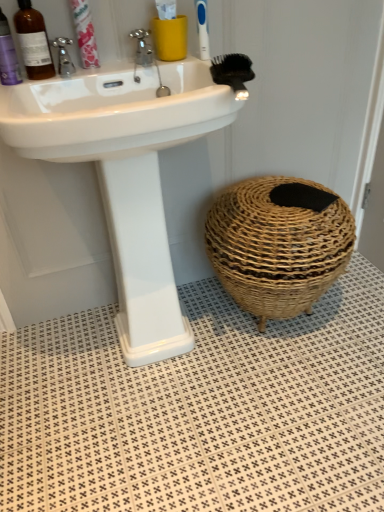
The height and width of the screenshot is (512, 384). In order to click on vacant space that's between pink paper toothpaste at upper left and metallic chrome faucet at upper center, the 2th tap viewed from the left in this screenshot , I will do `click(114, 69)`.